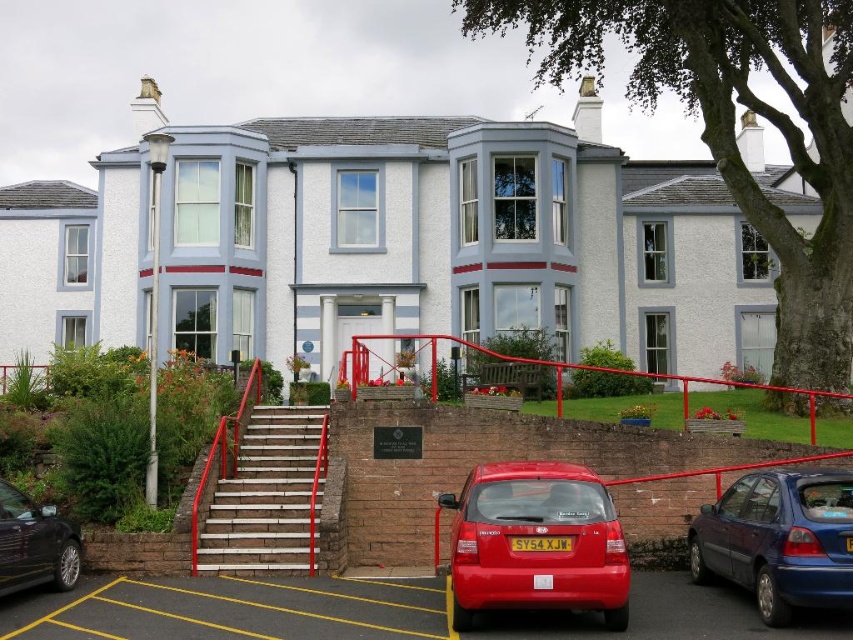
Question: Which point is farther from the camera taking this photo?

Choices:
 (A) (724, 500)
 (B) (28, 508)

Answer: (A)

Question: Where is metallic blue hatchback at lower right located in relation to white concrete stairs at center in the image?

Choices:
 (A) left
 (B) right

Answer: (B)

Question: Which point is closer to the camera?

Choices:
 (A) (21, 502)
 (B) (724, 621)
 (C) (758, 540)

Answer: (B)

Question: Observing the image, what is the correct spatial positioning of metallic blue hatchback at lower right in reference to white concrete stairs at center?

Choices:
 (A) above
 (B) below

Answer: (A)

Question: Which of the following is the closest to the observer?

Choices:
 (A) (729, 552)
 (B) (526, 544)
 (C) (77, 544)

Answer: (B)

Question: Does glossy red hatchback at lower right lie in front of metallic blue hatchback at lower right?

Choices:
 (A) no
 (B) yes

Answer: (A)